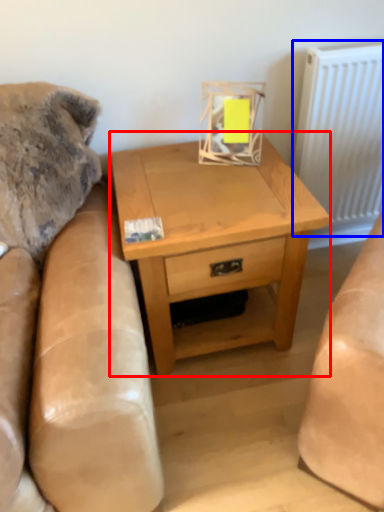
Question: Among these objects, which one is farthest to the camera, nightstand (highlighted by a red box) or radiator (highlighted by a blue box)?

Choices:
 (A) nightstand
 (B) radiator

Answer: (B)